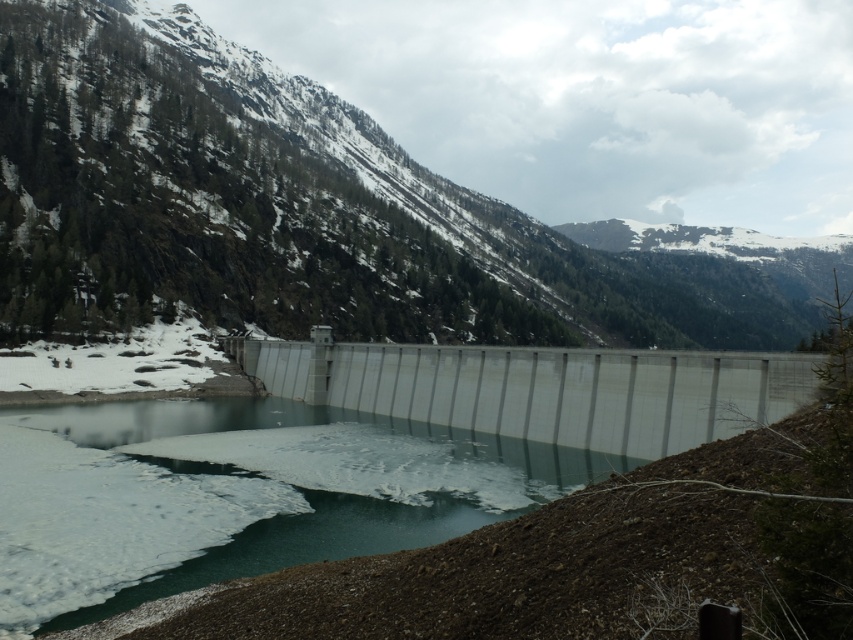
Which of these two, snowy forested mountain at upper center or translucent ice at center, stands taller?

With more height is snowy forested mountain at upper center.

Describe the element at coordinates (306, 216) in the screenshot. The height and width of the screenshot is (640, 853). I see `snowy forested mountain at upper center` at that location.

Describe the element at coordinates (306, 216) in the screenshot. I see `snowy forested mountain at upper center` at that location.

Locate an element on the screen. This screenshot has width=853, height=640. snowy forested mountain at upper center is located at coordinates (306, 216).

Is point (413, 454) behind point (358, 376)?

No, (413, 454) is in front of (358, 376).

Does translucent ice at center appear on the right side of gray concrete dam at center?

In fact, translucent ice at center is to the left of gray concrete dam at center.

Is point (440, 520) farther from camera compared to point (320, 372)?

No, (440, 520) is closer to viewer.

Locate an element on the screen. This screenshot has width=853, height=640. translucent ice at center is located at coordinates (236, 497).

Can you confirm if snowy forested mountain at upper center is positioned above gray concrete dam at center?

Yes, snowy forested mountain at upper center is above gray concrete dam at center.

Does snowy forested mountain at upper center appear on the left side of gray concrete dam at center?

No, snowy forested mountain at upper center is not to the left of gray concrete dam at center.

Find the location of a particular element. The width and height of the screenshot is (853, 640). snowy forested mountain at upper center is located at coordinates (306, 216).